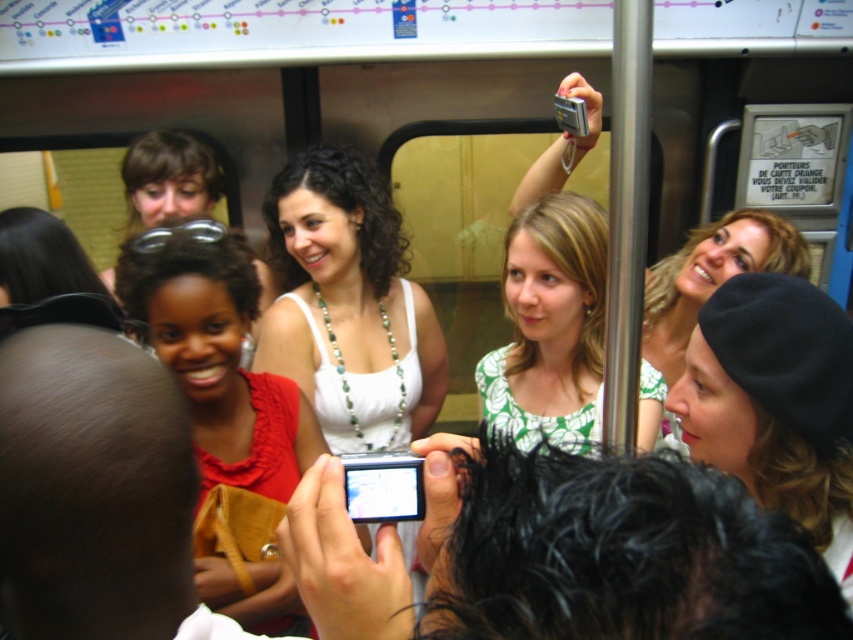
Can you confirm if white beaded necklace at center is smaller than matte red blouse at center?

Incorrect, white beaded necklace at center is not smaller in size than matte red blouse at center.

Which is behind, point (424, 381) or point (221, 276)?

Positioned behind is point (424, 381).

Who is more distant from viewer, (341, 298) or (209, 316)?

The point (341, 298) is behind.

Find the location of a particular element. This screenshot has width=853, height=640. white beaded necklace at center is located at coordinates (347, 305).

Looking at this image, is white beaded necklace at center bigger than green printed blouse at center?

Correct, white beaded necklace at center is larger in size than green printed blouse at center.

At what (x,y) coordinates should I click in order to perform the action: click on white beaded necklace at center. Please return your answer as a coordinate pair (x, y). This screenshot has width=853, height=640. Looking at the image, I should click on (347, 305).

Identify the location of white beaded necklace at center. This screenshot has height=640, width=853. (347, 305).

Identify the location of white beaded necklace at center. This screenshot has height=640, width=853. (347, 305).

Looking at this image, does green printed blouse at center have a smaller size compared to matte black beanie at upper right?

No, green printed blouse at center is not smaller than matte black beanie at upper right.

Which is behind, point (654, 406) or point (772, 224)?

The point (772, 224) is behind.

This screenshot has height=640, width=853. Find the location of `green printed blouse at center`. green printed blouse at center is located at coordinates pyautogui.click(x=550, y=324).